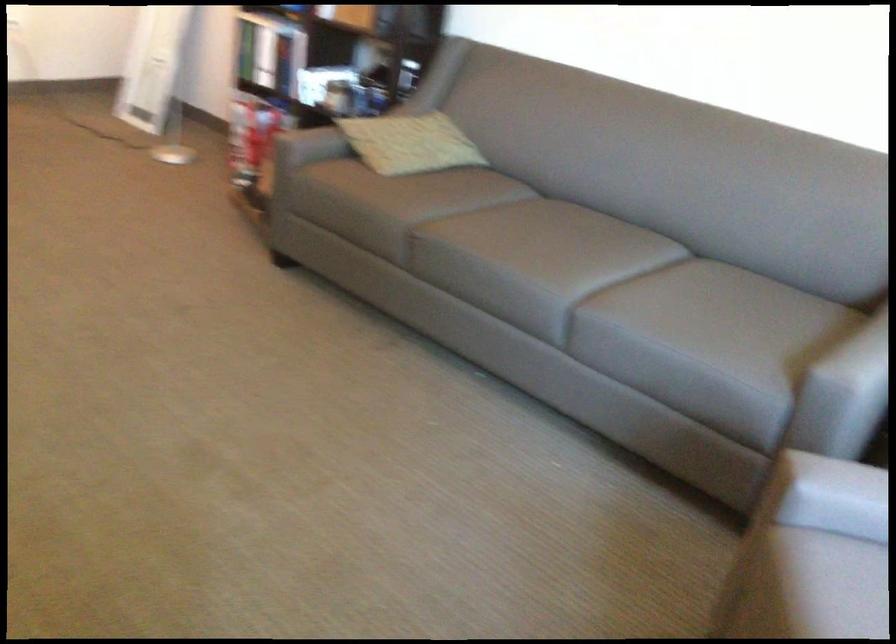
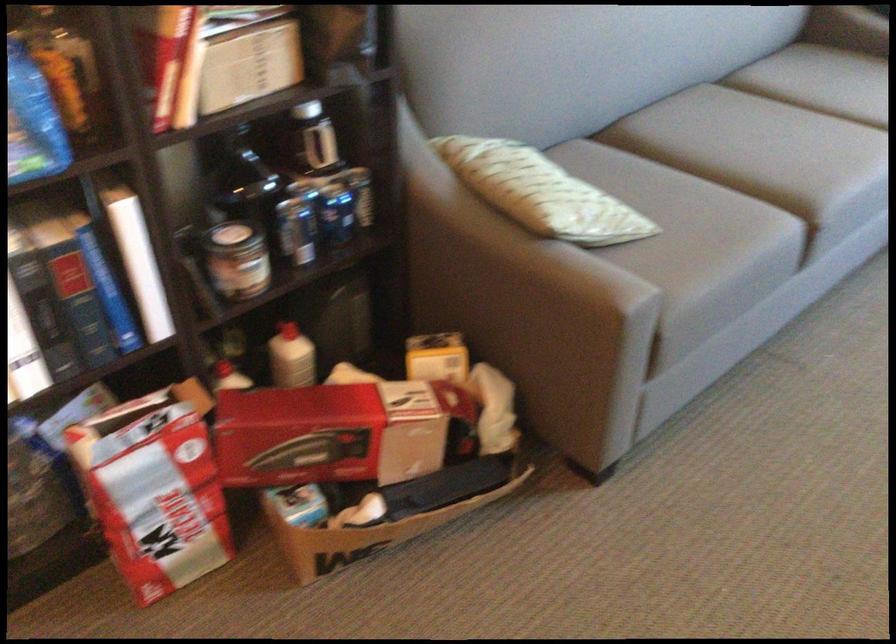
Locate, in the second image, the point that corresponds to the point at 504,228 in the first image.

(760, 147)